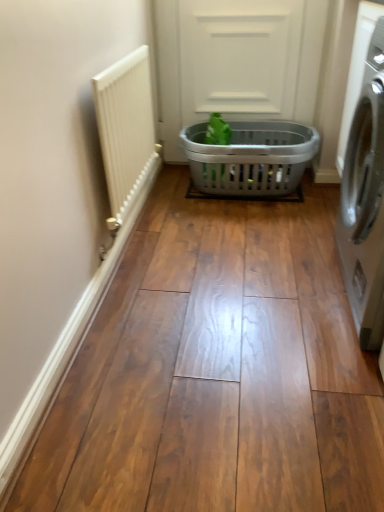
The image size is (384, 512). Find the location of `gray plastic laundry basket at center`. gray plastic laundry basket at center is located at coordinates (250, 158).

Locate an element on the screen. The image size is (384, 512). green matte plant at center is located at coordinates (217, 130).

Would you say satin silver washing machine at right is inside or outside green matte plant at center?

satin silver washing machine at right lies outside green matte plant at center.

Which object is thinner, satin silver washing machine at right or green matte plant at center?

green matte plant at center is thinner.

From a real-world perspective, who is located higher, satin silver washing machine at right or green matte plant at center?

satin silver washing machine at right.

Considering the relative sizes of satin silver washing machine at right and green matte plant at center in the image provided, is satin silver washing machine at right shorter than green matte plant at center?

In fact, satin silver washing machine at right may be taller than green matte plant at center.

Considering the sizes of objects satin silver washing machine at right and gray plastic laundry basket at center in the image provided, who is shorter, satin silver washing machine at right or gray plastic laundry basket at center?

Standing shorter between the two is gray plastic laundry basket at center.

Would you say satin silver washing machine at right is to the left or to the right of gray plastic laundry basket at center in the picture?

From the image, it's evident that satin silver washing machine at right is to the right of gray plastic laundry basket at center.

Based on the photo, what's the angular difference between satin silver washing machine at right and gray plastic laundry basket at center's facing directions?

There is a 87.9-degree angle between the facing directions of satin silver washing machine at right and gray plastic laundry basket at center.

Locate an element on the screen. The height and width of the screenshot is (512, 384). screen door on the left of satin silver washing machine at right is located at coordinates point(239,58).

From a real-world perspective, is white textured radiator at left physically located above or below satin silver washing machine at right?

From a real-world perspective, white textured radiator at left is physically below satin silver washing machine at right.

Can you confirm if white textured radiator at left is smaller than satin silver washing machine at right?

Indeed, white textured radiator at left has a smaller size compared to satin silver washing machine at right.

Can you tell me how much white textured radiator at left and satin silver washing machine at right differ in facing direction?

179 degrees separate the facing orientations of white textured radiator at left and satin silver washing machine at right.

Considering the positions of points (146, 84) and (362, 195), is point (146, 84) closer to camera compared to point (362, 195)?

No, it is not.

Find the location of `plant above the gray plastic laundry basket at center (from a real-world perspective)`. plant above the gray plastic laundry basket at center (from a real-world perspective) is located at coordinates (217, 130).

Can green matte plant at center be found inside gray plastic laundry basket at center?

That's correct, green matte plant at center is inside gray plastic laundry basket at center.

Is point (201, 163) closer to camera compared to point (214, 117)?

Yes, point (201, 163) is in front of point (214, 117).

Is gray plastic laundry basket at center directly adjacent to green matte plant at center?

No, gray plastic laundry basket at center is not beside green matte plant at center.

Between satin silver washing machine at right and white textured radiator at left, which one appears on the right side from the viewer's perspective?

satin silver washing machine at right is more to the right.

Consider the image. Looking at their sizes, would you say satin silver washing machine at right is wider or thinner than white textured radiator at left?

Clearly, satin silver washing machine at right has more width compared to white textured radiator at left.

Considering the positions of points (378, 66) and (122, 91), is point (378, 66) farther from camera compared to point (122, 91)?

No, it is not.

Identify the location of basket that is under the green matte plant at center (from a real-world perspective). (250, 158).

Is green matte plant at center turned away from gray plastic laundry basket at center?

Yes, green matte plant at center is positioned with its back facing gray plastic laundry basket at center.

From the image's perspective, who appears lower, green matte plant at center or gray plastic laundry basket at center?

gray plastic laundry basket at center is shown below in the image.

Based on the photo, in the image, is green matte plant at center positioned in front of or behind gray plastic laundry basket at center?

green matte plant at center is behind gray plastic laundry basket at center.

Find the location of a particular element. radiator below the gray plastic laundry basket at center (from a real-world perspective) is located at coordinates (125, 130).

Is white textured radiator at left oriented towards gray plastic laundry basket at center?

No, white textured radiator at left is not turned towards gray plastic laundry basket at center.

How distant is white textured radiator at left from gray plastic laundry basket at center?

A distance of 64.27 centimeters exists between white textured radiator at left and gray plastic laundry basket at center.

Which is behind, point (130, 130) or point (234, 31)?

The point (234, 31) is behind.

Identify the location of washing machine below the green matte plant at center (from the image's perspective). The height and width of the screenshot is (512, 384). (365, 202).

The height and width of the screenshot is (512, 384). Find the location of `screen door above the satin silver washing machine at right (from the image's perspective)`. screen door above the satin silver washing machine at right (from the image's perspective) is located at coordinates (239, 58).

When comparing their distances from gray plastic laundry basket at center, does gray plastic laundry basket at center or green matte plant at center seem closer?

green matte plant at center is positioned closer to the anchor gray plastic laundry basket at center.

From the picture: Which object lies nearer to the anchor point gray plastic laundry basket at center, green matte plant at center or white textured radiator at left?

green matte plant at center.

Looking at the image, which one is located further to gray plastic laundry basket at center, gray plastic laundry basket at center or green matte plant at center?

Based on the image, gray plastic laundry basket at center appears to be further to gray plastic laundry basket at center.

Estimate the real-world distances between objects in this image. Which object is further from satin silver washing machine at right, white textured radiator at left or gray plastic laundry basket at center?

white textured radiator at left is further to satin silver washing machine at right.

When comparing their distances from white textured radiator at left, does gray plastic laundry basket at center or green matte plant at center seem closer?

The object closer to white textured radiator at left is gray plastic laundry basket at center.

In the scene shown: Based on their spatial positions, is satin silver washing machine at right or gray plastic laundry basket at center closer to white textured radiator at left?

Based on the image, gray plastic laundry basket at center appears to be nearer to white textured radiator at left.

From the image, which object appears to be farther from gray plastic laundry basket at center, white textured radiator at left or gray plastic laundry basket at center?

white textured radiator at left.

Estimate the real-world distances between objects in this image. Which object is further from white textured radiator at left, gray plastic laundry basket at center or satin silver washing machine at right?

Among the two, satin silver washing machine at right is located further to white textured radiator at left.

I want to click on radiator between satin silver washing machine at right and gray plastic laundry basket at center in the front-back direction, so click(x=125, y=130).

Find the location of `radiator positioned between satin silver washing machine at right and green matte plant at center from near to far`. radiator positioned between satin silver washing machine at right and green matte plant at center from near to far is located at coordinates (125, 130).

Where is `screen door between satin silver washing machine at right and green matte plant at center from front to back`? Image resolution: width=384 pixels, height=512 pixels. screen door between satin silver washing machine at right and green matte plant at center from front to back is located at coordinates (239, 58).

Identify the location of basket between satin silver washing machine at right and green matte plant at center along the z-axis. Image resolution: width=384 pixels, height=512 pixels. (250, 158).